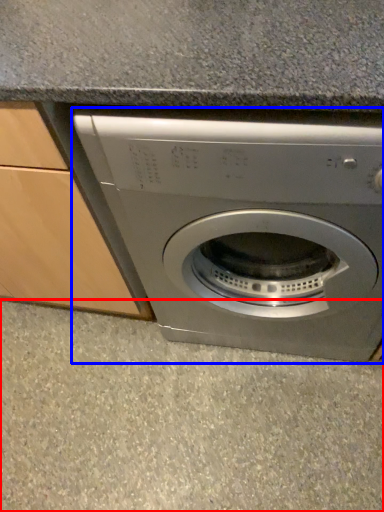
Question: Which point is further to the camera, concrete (highlighted by a red box) or washing machine (highlighted by a blue box)?

Choices:
 (A) concrete
 (B) washing machine

Answer: (A)